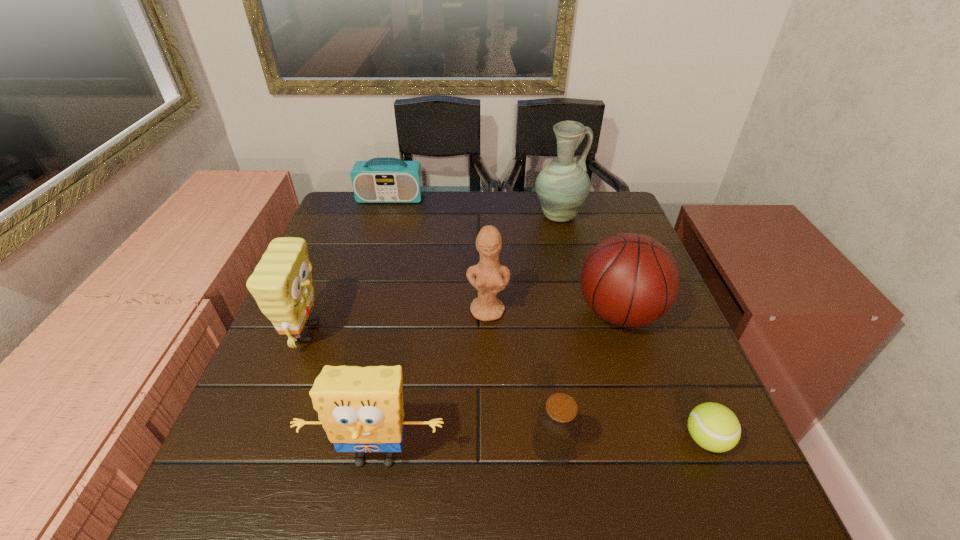
In order to click on object that is the nearest to the figurine in this screenshot , I will do `click(628, 279)`.

Identify which object is located as the fifth nearest to the radio receiver. Please provide its 2D coordinates. Your answer should be formatted as a tuple, i.e. [(x, y)], where the tuple contains the x and y coordinates of a point satisfying the conditions above.

[(361, 409)]

In order to click on free location that satisfies the following two spatial constraints: 1. on the front panel of the radio receiver; 2. on the left side of the jar in this screenshot , I will do `click(318, 445)`.

Identify the location of blank area in the image that satisfies the following two spatial constraints: 1. on the front-facing side of the figurine; 2. on the face of the left sponge. This screenshot has height=540, width=960. (489, 333).

Find the location of a particular element. This screenshot has height=540, width=960. vacant area that satisfies the following two spatial constraints: 1. on the face of the farther sponge; 2. on the right side of the seventh tallest object is located at coordinates (263, 445).

Image resolution: width=960 pixels, height=540 pixels. What are the coordinates of `free space that satisfies the following two spatial constraints: 1. on the front panel of the radio receiver; 2. on the face of the farther sponge` in the screenshot? It's located at (351, 333).

I want to click on vacant point that satisfies the following two spatial constraints: 1. on the front panel of the jar; 2. on the left side of the radio receiver, so click(x=318, y=445).

Where is `vacant space that satisfies the following two spatial constraints: 1. on the front panel of the jar; 2. on the left side of the radio receiver`? vacant space that satisfies the following two spatial constraints: 1. on the front panel of the jar; 2. on the left side of the radio receiver is located at coordinates (318, 445).